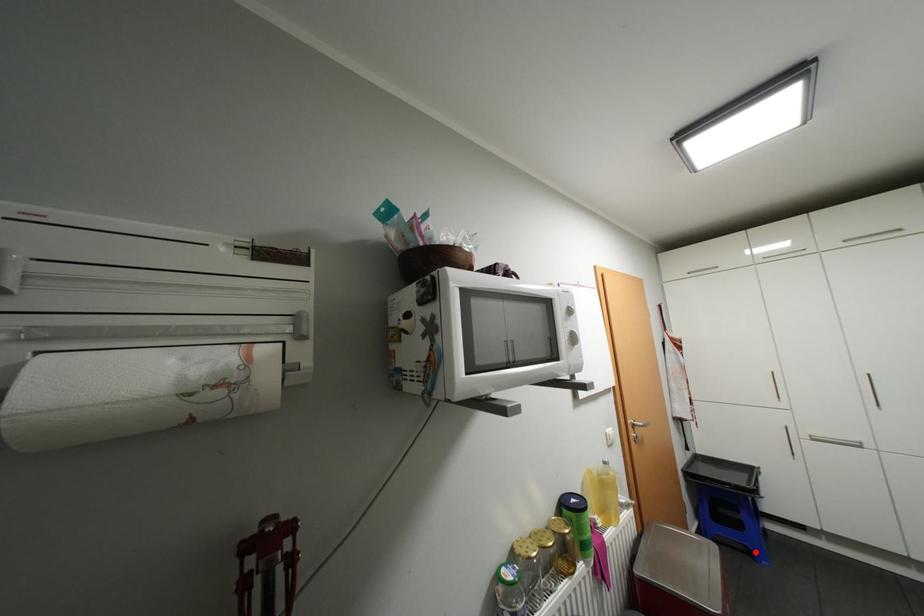
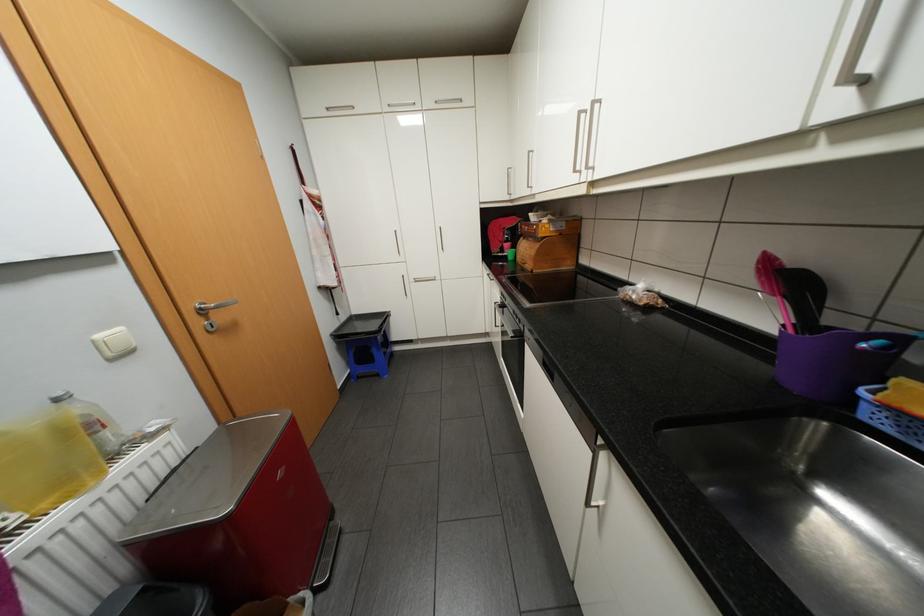
Question: A red point is marked in image1. In image2, is the corresponding 3D point closer to the camera or farther? Reply with the corresponding letter.

Choices:
 (A) The corresponding 3D point is closer.
 (B) The corresponding 3D point is farther.

Answer: (B)